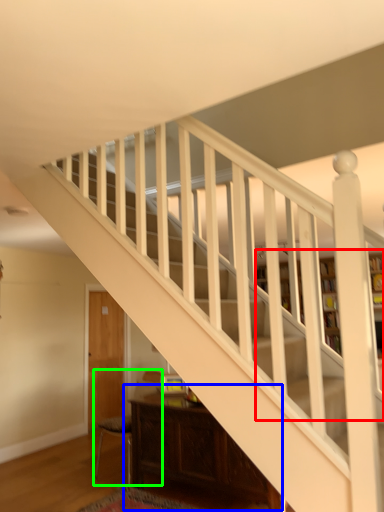
Question: Which object is positioned farthest from bookcase (highlighted by a red box)? Select from table (highlighted by a blue box) and armchair (highlighted by a green box).

Choices:
 (A) table
 (B) armchair

Answer: (B)